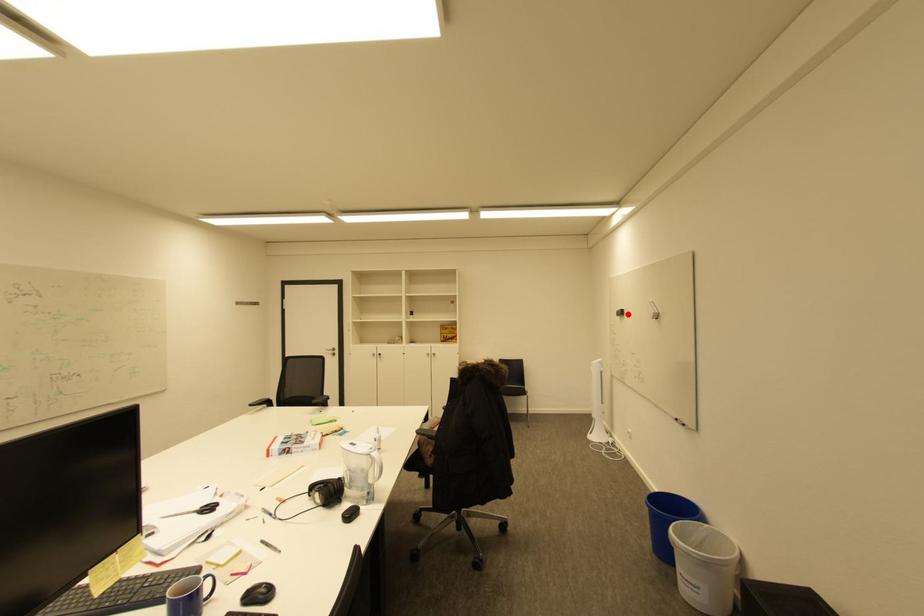
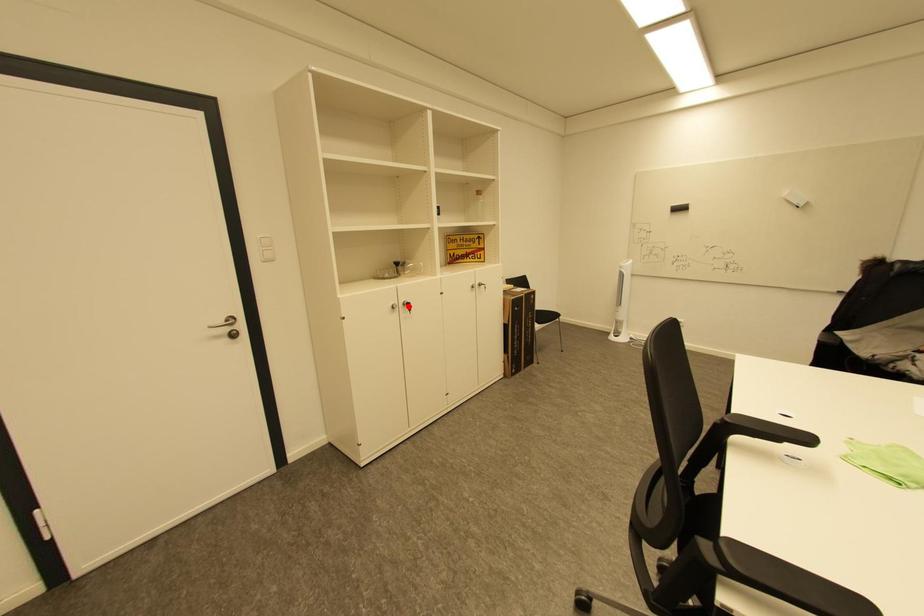
I am providing you with two images of the same scene from different viewpoints. A red point is marked on the first image and another point is marked on the second image. Are the points marked in image1 and image2 representing the same 3D position?

No